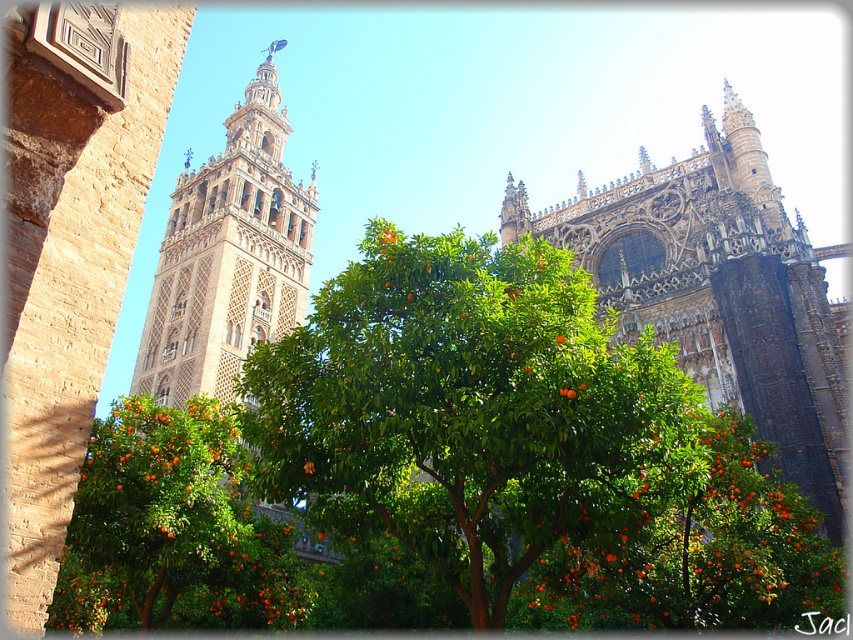
Question: Is green leafy tree at center positioned at the back of green leafy tree with orange fruits at center?

Choices:
 (A) yes
 (B) no

Answer: (A)

Question: Can you confirm if green leafy tree with orange fruits at center is smaller than beige stone tower at left?

Choices:
 (A) no
 (B) yes

Answer: (B)

Question: Which is farther from the green leafy tree at center?

Choices:
 (A) beige stone tower at left
 (B) green leafy tree with orange fruits at center

Answer: (A)

Question: Which point is farther to the camera?

Choices:
 (A) (256, 602)
 (B) (347, 317)
 (C) (236, 212)

Answer: (C)

Question: Which point is closer to the camera taking this photo?

Choices:
 (A) (142, 625)
 (B) (366, 404)

Answer: (B)

Question: Does green leafy tree at center have a lesser width compared to beige stone tower at left?

Choices:
 (A) yes
 (B) no

Answer: (B)